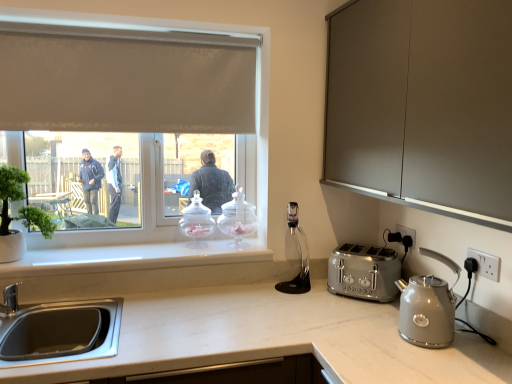
The height and width of the screenshot is (384, 512). I want to click on free region under green matte plant at left (from a real-world perspective), so click(28, 255).